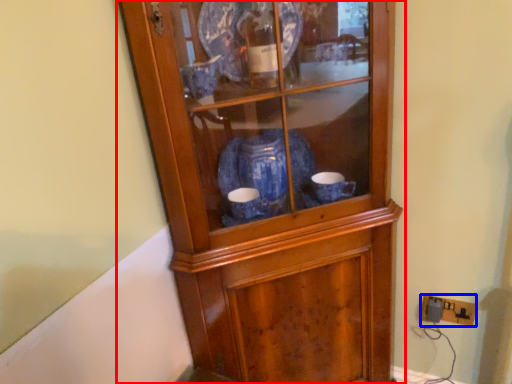
Question: Among these objects, which one is farthest to the camera, cupboard (highlighted by a red box) or electric outlet (highlighted by a blue box)?

Choices:
 (A) cupboard
 (B) electric outlet

Answer: (B)